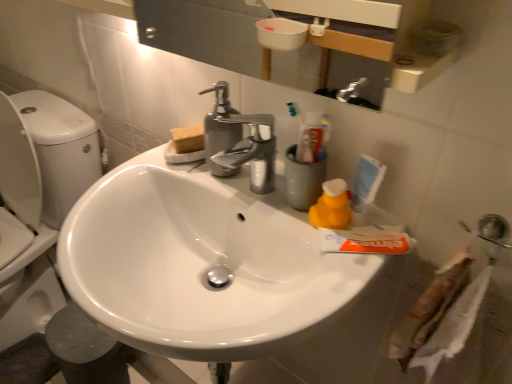
The image size is (512, 384). Find the location of `blank space to the left of yellow rubber duck at right`. blank space to the left of yellow rubber duck at right is located at coordinates (267, 205).